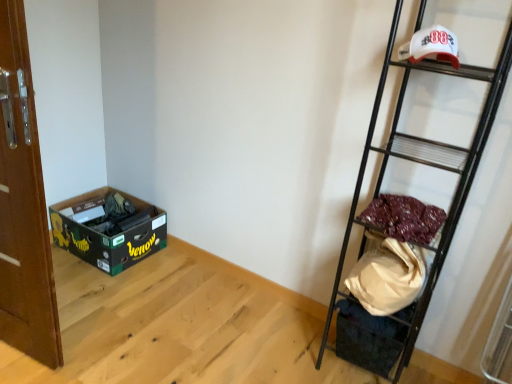
The width and height of the screenshot is (512, 384). I want to click on vacant area that lies to the right of green cardboard box at lower left, so click(x=170, y=275).